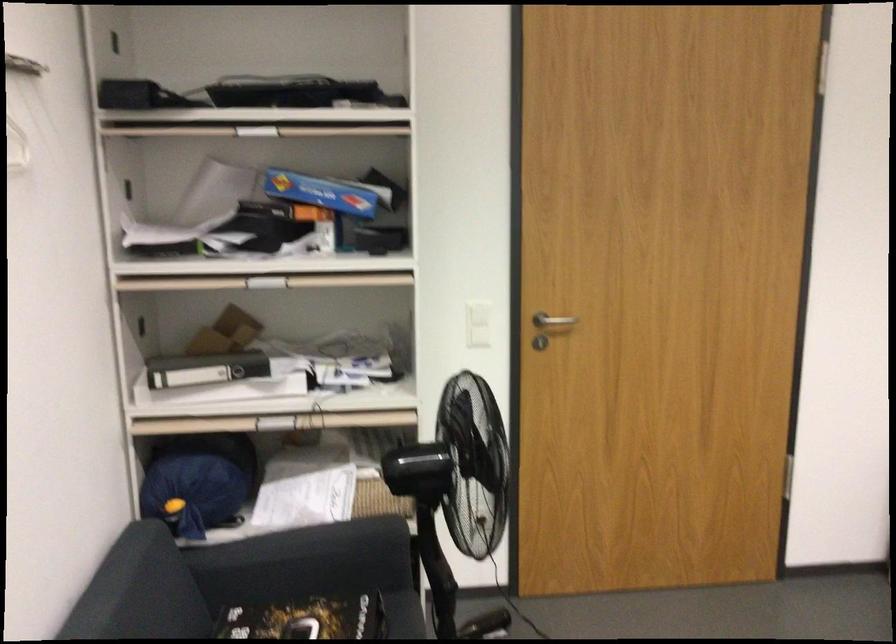
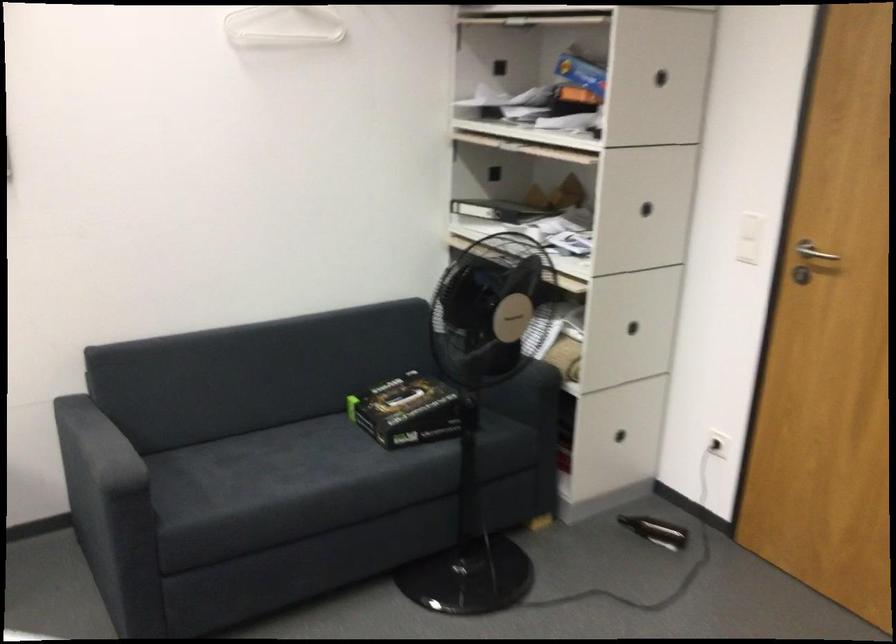
The point at (543, 330) is marked in the first image. Where is the corresponding point in the second image?

(813, 252)